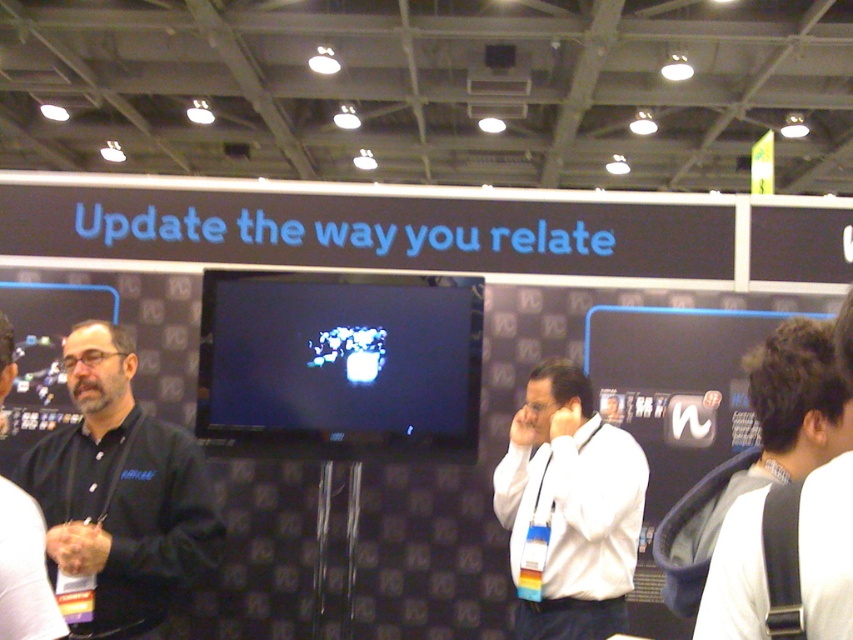
Does white matte shirt at center have a larger size compared to white shirt at right?

Yes.

The image size is (853, 640). Describe the element at coordinates (569, 508) in the screenshot. I see `white matte shirt at center` at that location.

Find the location of a particular element. white matte shirt at center is located at coordinates (569, 508).

Which is above, black matte shirt at left or white matte shirt at center?

Positioned higher is black matte shirt at left.

Which is more to the right, black matte shirt at left or white matte shirt at center?

white matte shirt at center is more to the right.

Which is behind, point (126, 541) or point (566, 608)?

Point (566, 608)

Identify the location of black matte shirt at left. (119, 497).

Is black matte shirt at left shorter than dark blue shirt at left?

No, black matte shirt at left is not shorter than dark blue shirt at left.

Does point (57, 477) come closer to viewer compared to point (38, 561)?

No, it is behind (38, 561).

Identify the location of black matte shirt at left. (119, 497).